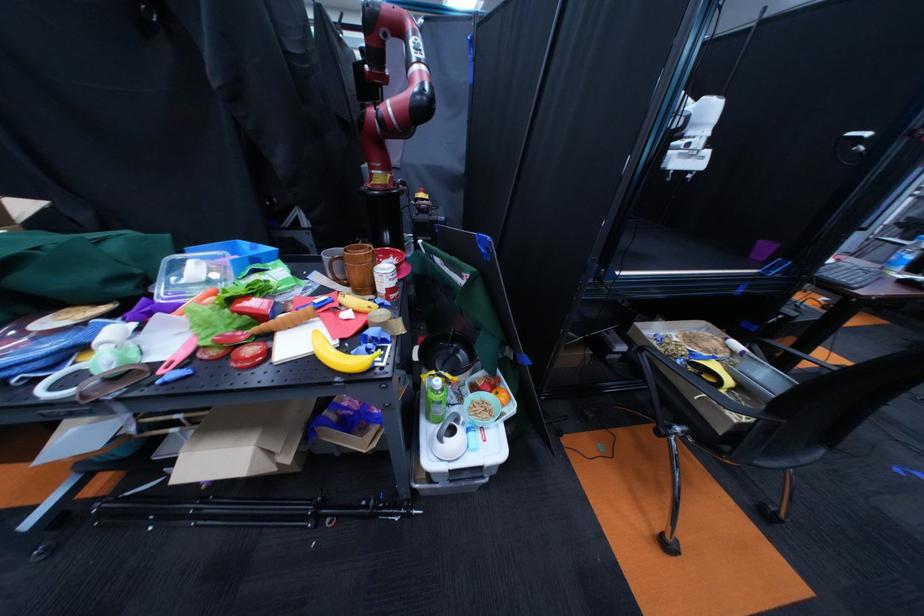
Describe the element at coordinates (448, 438) in the screenshot. Image resolution: width=924 pixels, height=616 pixels. I see `the white pitcher handle` at that location.